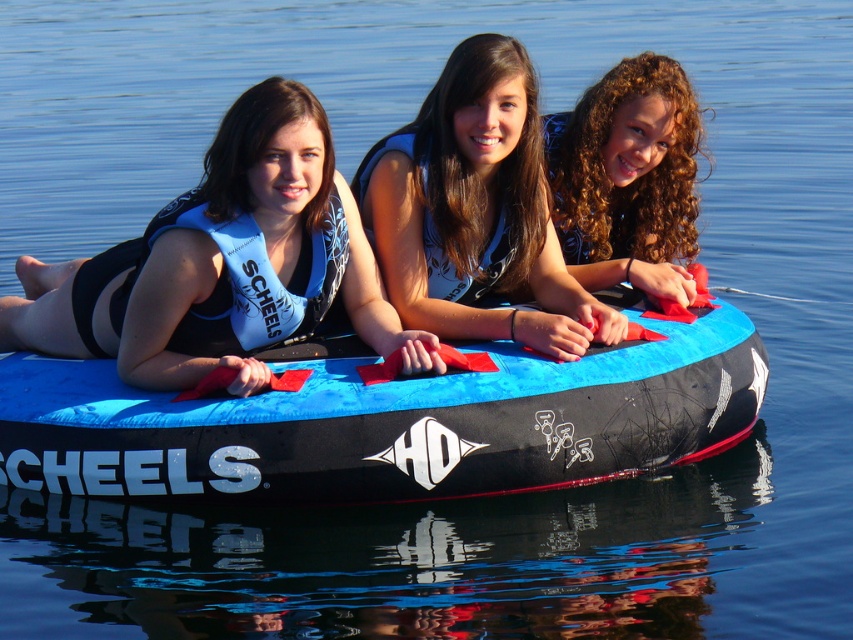
Question: Observing the image, what is the correct spatial positioning of blue fabric life vest at center in reference to curly hair at center?

Choices:
 (A) below
 (B) above

Answer: (A)

Question: Is matte blue life vest at left below curly hair at center?

Choices:
 (A) no
 (B) yes

Answer: (B)

Question: Considering the real-world distances, which object is farthest from the curly hair at center?

Choices:
 (A) blue fabric tube at center
 (B) blue fabric life vest at center

Answer: (A)

Question: Which point is closer to the camera?

Choices:
 (A) (289, 396)
 (B) (560, 124)
 (C) (171, 340)

Answer: (A)

Question: Observing the image, what is the correct spatial positioning of matte blue life vest at left in reference to curly hair at center?

Choices:
 (A) below
 (B) above

Answer: (A)

Question: Which of the following is the farthest from the observer?

Choices:
 (A) blue fabric tube at center
 (B) matte blue life vest at left

Answer: (B)